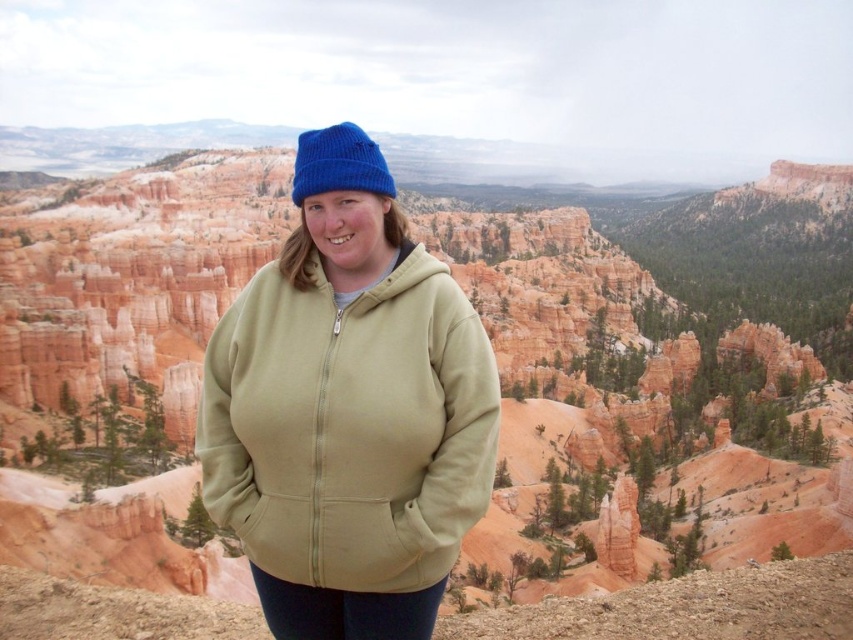
You are navigating a rugged terrain with hoodoos in the background. You need to place a GPS marker exactly where the sage green fleece jacket at center is located. According to the coordinate system provided, where should you place the marker?

The sage green fleece jacket at center should be marked at the coordinates point (349, 426) as specified.

You are a photographer trying to capture the best angle of the two points in the image. Given that point A is at coordinates point (338, 541) and point B is at point (347, 140), which point should you focus on first to ensure it appears closer in the photo?

Point A at coordinates point (338, 541) should be focused on first because it is closer to the viewer than point B at point (347, 140), making it appear nearer in the photograph.